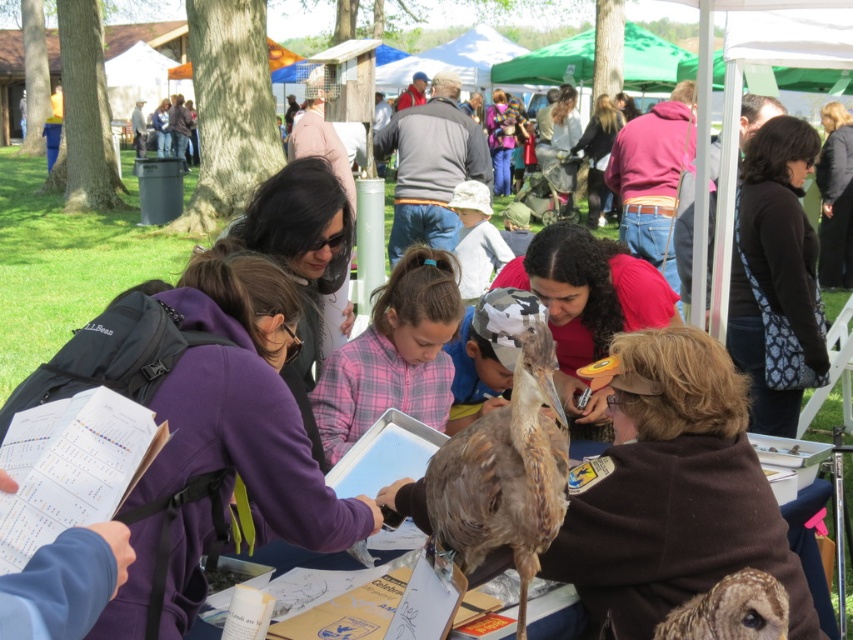
Who is positioned more to the left, matte red shirt at center or white cotton hat at center?

white cotton hat at center is more to the left.

Who is more forward, (653, 296) or (474, 256)?

Positioned in front is point (653, 296).

Does point (653, 296) lie in front of point (469, 262)?

Yes, it is in front of point (469, 262).

At what (x,y) coordinates should I click in order to perform the action: click on matte red shirt at center. Please return your answer as a coordinate pair (x, y). The image size is (853, 640). Looking at the image, I should click on (590, 305).

Measure the distance from purple fleece jacket at center to matte black jacket at center.

purple fleece jacket at center is 16.76 inches from matte black jacket at center.

Can you confirm if purple fleece jacket at center is bigger than matte black jacket at center?

No, purple fleece jacket at center is not bigger than matte black jacket at center.

Which is in front, point (209, 355) or point (303, 256)?

Point (209, 355)

You are a GUI agent. You are given a task and a screenshot of the screen. Output one action in this format:
    pyautogui.click(x=<x>, y=<y>)
    Task: Click on the purple fleece jacket at center
    This screenshot has width=853, height=640.
    Given the screenshot: What is the action you would take?
    pyautogui.click(x=225, y=448)

Can you confirm if purple fleece jacket at center is taller than brown speckled owl at lower right?

Correct, purple fleece jacket at center is much taller as brown speckled owl at lower right.

Is point (355, 502) more distant than point (722, 620)?

Yes.

Is point (167, 579) in front of point (723, 621)?

No.

At what (x,y) coordinates should I click in order to perform the action: click on purple fleece jacket at center. Please return your answer as a coordinate pair (x, y). Looking at the image, I should click on (225, 448).